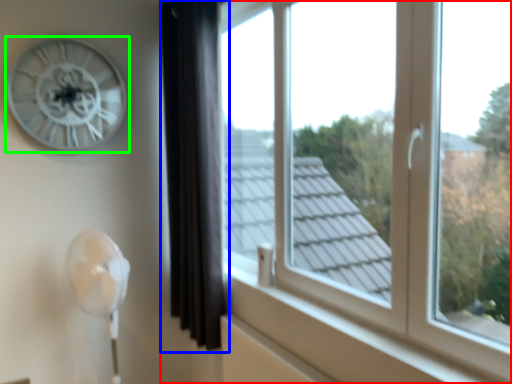
Question: Which object is the closest to the window (highlighted by a red box)? Choose among these: curtain (highlighted by a blue box) or wall clock (highlighted by a green box).

Choices:
 (A) curtain
 (B) wall clock

Answer: (A)